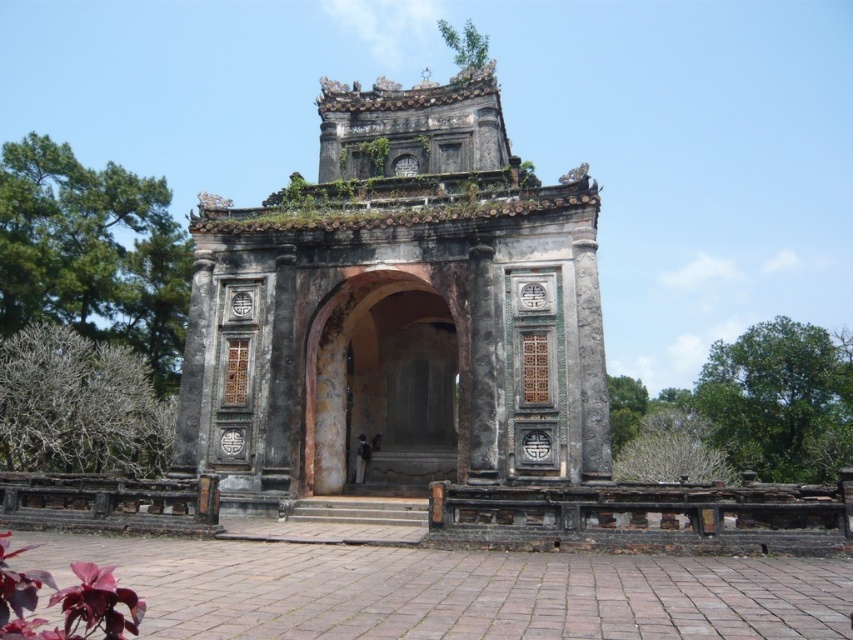
Which is above, green leafy tree at left or bare branches at left?

green leafy tree at left is above.

Is the position of green leafy tree at left less distant than that of bare branches at left?

No, it is behind bare branches at left.

Between point (97, 246) and point (61, 452), which one is positioned behind?

The point (97, 246) is behind.

In order to click on green leafy tree at left in this screenshot , I will do `click(91, 252)`.

What do you see at coordinates (91, 252) in the screenshot? I see `green leafy tree at left` at bounding box center [91, 252].

Can you confirm if green leafy tree at left is positioned above green leafy tree at right?

Indeed, green leafy tree at left is positioned over green leafy tree at right.

Which is behind, point (161, 289) or point (827, 362)?

The point (827, 362) is more distant.

Locate an element on the screen. green leafy tree at left is located at coordinates (91, 252).

Does rusty stone archway at center have a larger size compared to green leafy tree at right?

Actually, rusty stone archway at center might be smaller than green leafy tree at right.

Find the location of a particular element. The height and width of the screenshot is (640, 853). rusty stone archway at center is located at coordinates (384, 381).

The height and width of the screenshot is (640, 853). I want to click on rusty stone archway at center, so click(x=384, y=381).

Identify the location of rusty stone archway at center. This screenshot has width=853, height=640. (384, 381).